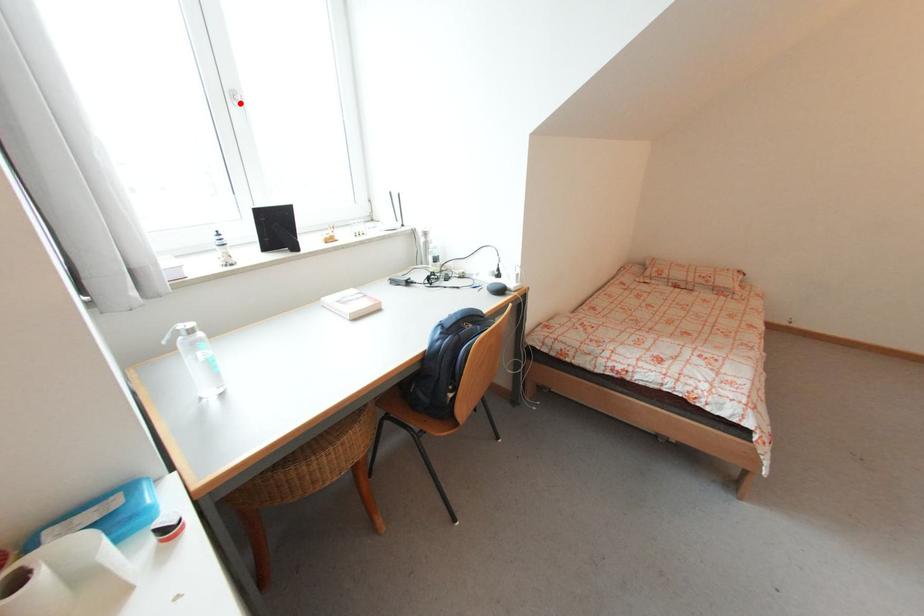
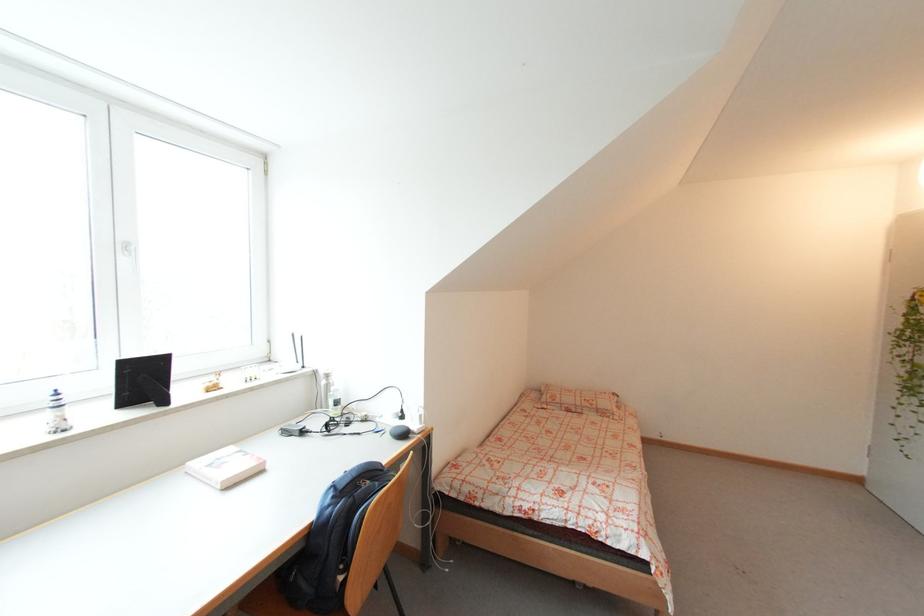
In the second image, find the point that corresponds to the highlighted location in the first image.

(130, 253)